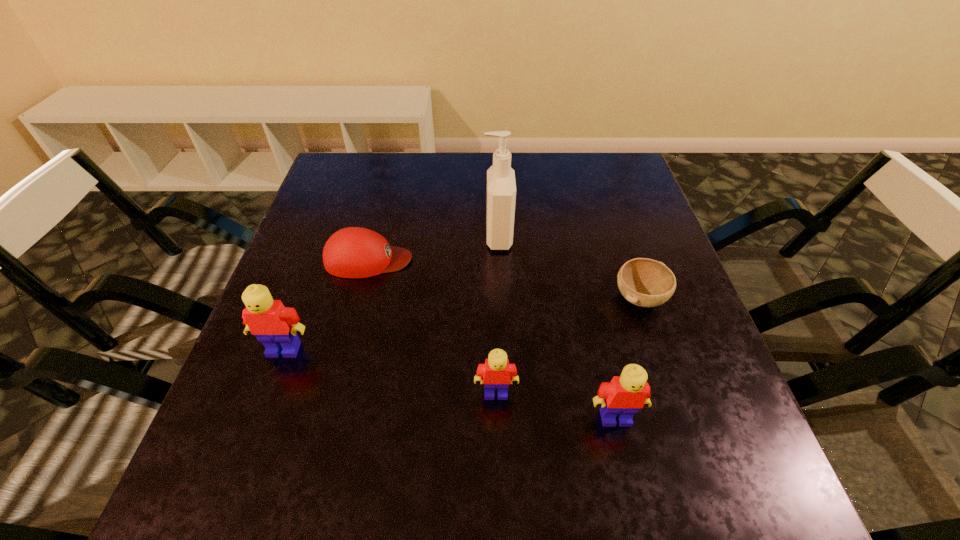
Identify the location of vacant position for inserting another Lego evenly. The image size is (960, 540). (386, 370).